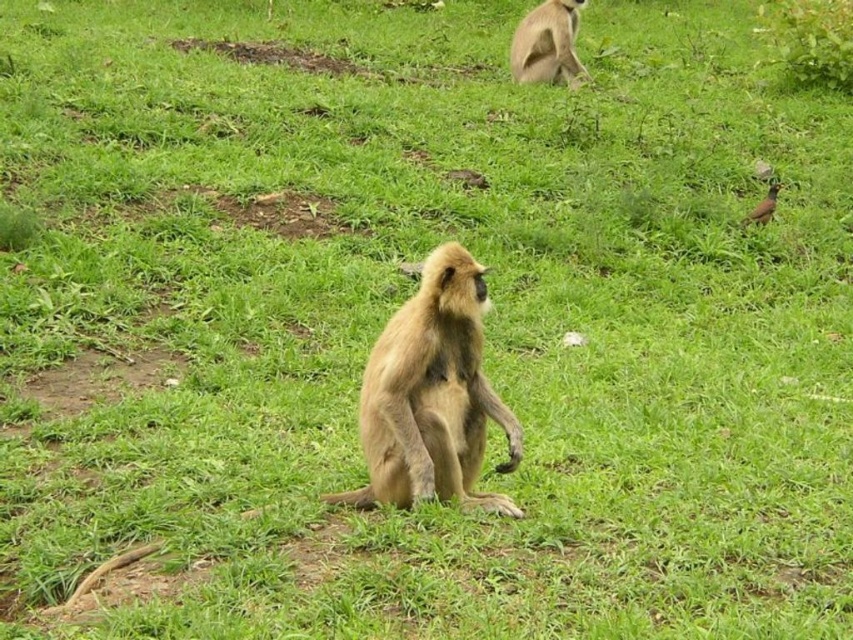
You are a wildlife photographer trying to capture a photo of both monkeys. You notice that the golden fur monkey at center is closer to you than the light brown fur monkey at upper center. Which monkey should you focus on first to ensure both are in focus?

You should focus on the light brown fur monkey at upper center first because it is farther away and larger in size, ensuring both will be in focus when using depth of field techniques.

You are a wildlife photographer standing 2 meters away from a tree. You want to take a photo of the golden fur monkey at center. If you move forward 1.5 meters towards the monkey, will you be closer than 2 meters to it?

The golden fur monkey at center is initially 3.51 meters away. After moving forward 1.5 meters, your distance becomes 3.51m minus 1.5m equals 2.01 meters. Since 2.01 meters is just over 2 meters, you will not be closer than 2 meters to the golden fur monkey at center.

Based on the photo, you are a wildlife researcher observing two monkeys in a grassy area. You notice a point at coordinates (432, 396). Which monkey is located at that point?

The point at coordinates (432, 396) indicates the golden fur monkey at center.